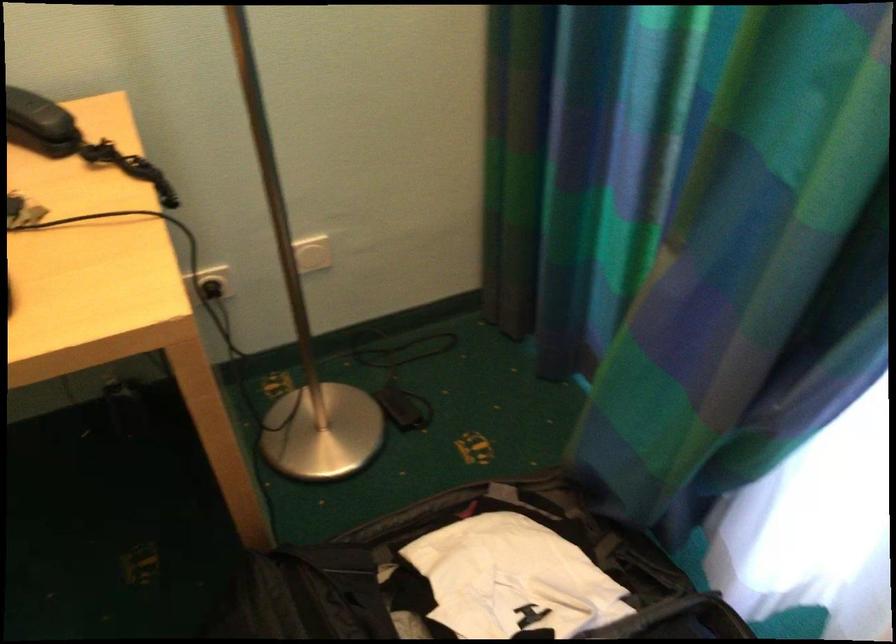
Describe the element at coordinates (435, 512) in the screenshot. I see `the suitcase buckle` at that location.